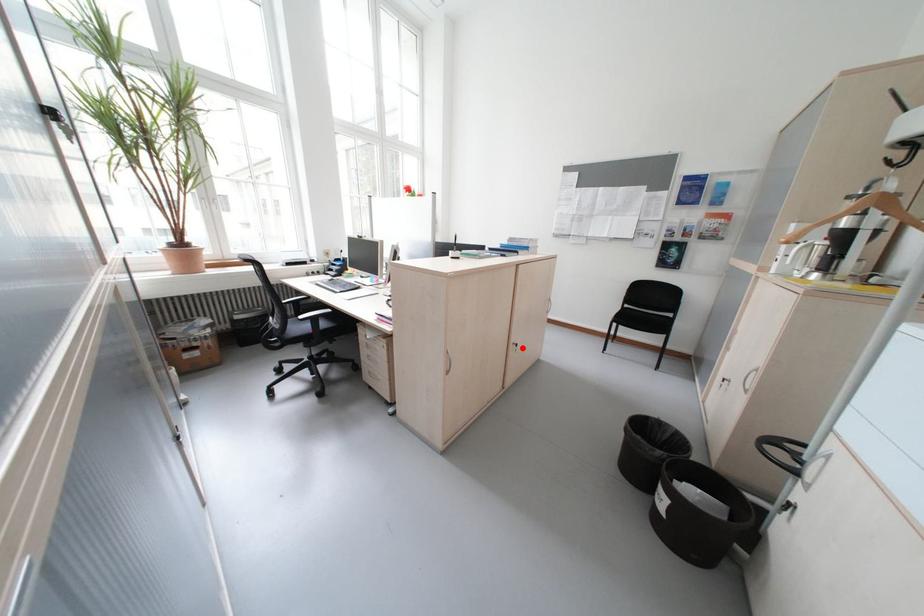
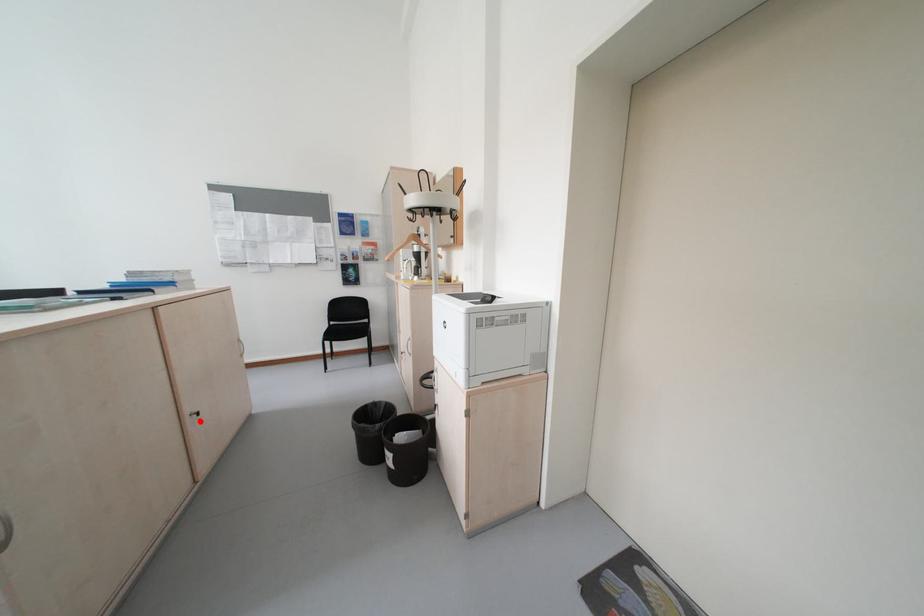
I am providing you with two images of the same scene from different viewpoints. A red point is marked on the first image and another point is marked on the second image. Is the red point in image1 aligned with the point shown in image2?

Yes